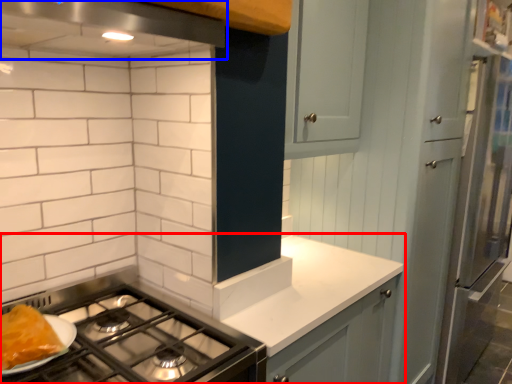
Question: Which object appears farthest to the camera in this image, countertop (highlighted by a red box) or exhaust hood (highlighted by a blue box)?

Choices:
 (A) countertop
 (B) exhaust hood

Answer: (A)